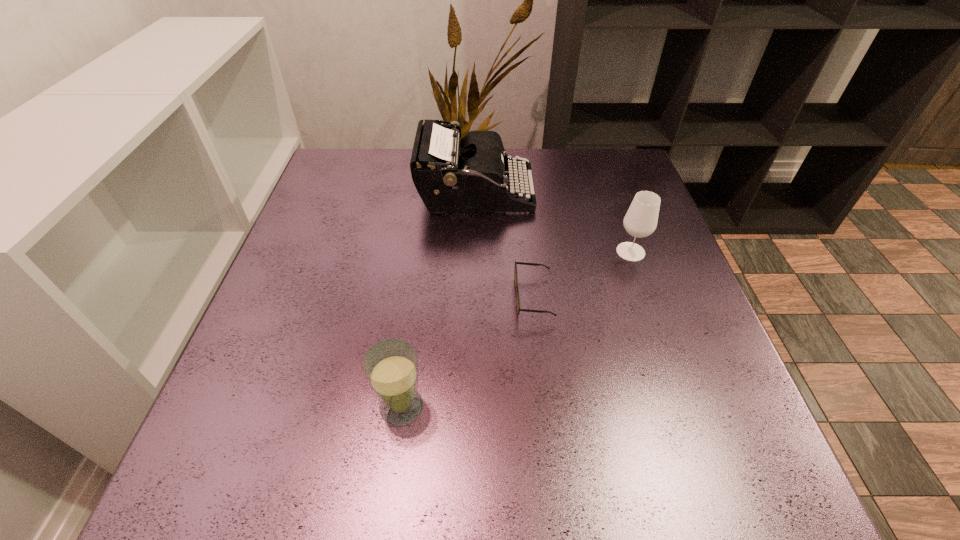
Where is `free space located on the front-facing side of the shortest object`? This screenshot has width=960, height=540. free space located on the front-facing side of the shortest object is located at coordinates (322, 298).

Locate an element on the screen. blank space located on the front-facing side of the shortest object is located at coordinates (481, 298).

You are a GUI agent. You are given a task and a screenshot of the screen. Output one action in this format:
    pyautogui.click(x=<x>, y=<y>)
    Task: Click on the vacant space situated on the front-facing side of the shortest object
    
    Given the screenshot: What is the action you would take?
    pyautogui.click(x=316, y=298)

Where is `object at the far edge`? object at the far edge is located at coordinates (451, 175).

Where is `object at the right edge`? The width and height of the screenshot is (960, 540). object at the right edge is located at coordinates (641, 219).

This screenshot has width=960, height=540. In the image, there is a desktop. In order to click on vacant space at the far edge in this screenshot , I will do `click(403, 167)`.

Where is `free point at the near edge`? This screenshot has height=540, width=960. free point at the near edge is located at coordinates (601, 468).

In the image, there is a desktop. Identify the location of vacant area at the left edge. This screenshot has width=960, height=540. (240, 376).

The height and width of the screenshot is (540, 960). In the image, there is a desktop. Find the location of `vacant space at the right edge`. vacant space at the right edge is located at coordinates (670, 259).

In the image, there is a desktop. Identify the location of blank space at the far left corner. (362, 165).